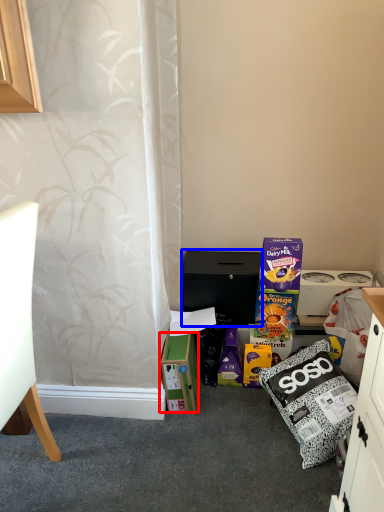
Question: Among these objects, which one is farthest to the camera, box (highlighted by a red box) or cabinetry (highlighted by a blue box)?

Choices:
 (A) box
 (B) cabinetry

Answer: (B)